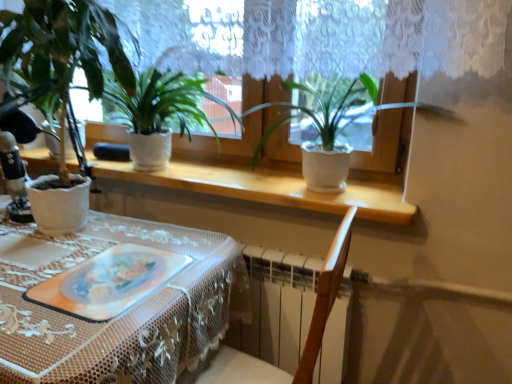
The image size is (512, 384). I want to click on white textured pot at center, so click(267, 188).

Describe the element at coordinates (164, 103) in the screenshot. I see `matte white pot at center, which is the 2th houseplant from right to left` at that location.

Identify the location of matte white pot at center, placed as the second houseplant when sorted from left to right. (164, 103).

This screenshot has width=512, height=384. What do you see at coordinates (61, 52) in the screenshot? I see `white textured pot at left, arranged as the 3th houseplant when viewed from the right` at bounding box center [61, 52].

In order to face white matte pot at center, acting as the 1th houseplant starting from the right, should I rotate leftwards or rightwards?

A 11.665 degree turn to the right will do.

The height and width of the screenshot is (384, 512). In order to click on white matte pot at center, the third houseplant positioned from the left in this screenshot , I will do `click(332, 126)`.

Where is `white textured pot at center`? white textured pot at center is located at coordinates pyautogui.click(x=267, y=188).

Which object is thinner, white lace tablecloth at lower left or white matte pot at center, acting as the 1th houseplant starting from the right?

white matte pot at center, acting as the 1th houseplant starting from the right.

How far apart are white lace tablecloth at lower left and white matte pot at center, acting as the 1th houseplant starting from the right?

white lace tablecloth at lower left and white matte pot at center, acting as the 1th houseplant starting from the right, are 26.05 inches apart.

Is white lace tablecloth at lower left positioned far away from white matte pot at center, acting as the 1th houseplant starting from the right?

They are positioned close to each other.

From a real-world perspective, starting from the white lace tablecloth at lower left, which houseplant is the 2nd one vertically above it? Please provide its 2D coordinates.

[(332, 126)]

Is translucent plastic platter at center facing towards white lace tablecloth at lower left?

Result: No, translucent plastic platter at center is not turned towards white lace tablecloth at lower left.

From the image's perspective, is translucent plastic platter at center located above white lace tablecloth at lower left?

Yes, from the image's perspective, translucent plastic platter at center is over white lace tablecloth at lower left.

Relative to white lace tablecloth at lower left, is translucent plastic platter at center in front or behind?

In the image, translucent plastic platter at center appears behind white lace tablecloth at lower left.

Does point (97, 316) appear closer or farther from the camera than point (187, 333)?

Point (97, 316).

Looking at this image, could white textured pot at center be considered to be inside white lace tablecloth at lower left?

That's incorrect, white textured pot at center is not inside white lace tablecloth at lower left.

Which object is thinner, white lace tablecloth at lower left or white textured pot at center?

Thinner between the two is white textured pot at center.

Based on the photo, from the image's perspective, which one is positioned higher, white lace tablecloth at lower left or white textured pot at center?

white textured pot at center is shown above in the image.

How many degrees apart are the facing directions of matte white pot at center, which is the 2th houseplant from right to left, and white textured pot at left, the 1th houseplant in the left-to-right sequence?

5.21 degrees separate the facing orientations of matte white pot at center, which is the 2th houseplant from right to left, and white textured pot at left, the 1th houseplant in the left-to-right sequence.

Is matte white pot at center, placed as the second houseplant when sorted from left to right, positioned with its back to white textured pot at left, the 1th houseplant in the left-to-right sequence?

No, matte white pot at center, placed as the second houseplant when sorted from left to right, is not facing away from white textured pot at left, the 1th houseplant in the left-to-right sequence.

From the image's perspective, does matte white pot at center, which is the 2th houseplant from right to left, appear lower than white textured pot at left, arranged as the 3th houseplant when viewed from the right?

Actually, matte white pot at center, which is the 2th houseplant from right to left, appears above white textured pot at left, arranged as the 3th houseplant when viewed from the right, in the image.

From a real-world perspective, which object rests below the other?

matte white pot at center, placed as the second houseplant when sorted from left to right, is physically lower.

Does white textured pot at left, the 1th houseplant in the left-to-right sequence, have a lesser height compared to white matte pot at center, acting as the 1th houseplant starting from the right?

In fact, white textured pot at left, the 1th houseplant in the left-to-right sequence, may be taller than white matte pot at center, acting as the 1th houseplant starting from the right.

From a real-world perspective, is white textured pot at left, arranged as the 3th houseplant when viewed from the right, positioned above or below white matte pot at center, the third houseplant positioned from the left?

From a real-world perspective, white textured pot at left, arranged as the 3th houseplant when viewed from the right, is physically above white matte pot at center, the third houseplant positioned from the left.

Which object is wider, white textured pot at left, arranged as the 3th houseplant when viewed from the right, or white matte pot at center, the third houseplant positioned from the left?

Wider between the two is white textured pot at left, arranged as the 3th houseplant when viewed from the right.

From the picture: Is the position of white textured pot at left, the 1th houseplant in the left-to-right sequence, more distant than that of white matte pot at center, acting as the 1th houseplant starting from the right?

No, it is in front of white matte pot at center, acting as the 1th houseplant starting from the right.

In terms of height, does translucent plastic platter at center look taller or shorter compared to white matte pot at center, acting as the 1th houseplant starting from the right?

Clearly, translucent plastic platter at center is shorter compared to white matte pot at center, acting as the 1th houseplant starting from the right.

Starting from the translucent plastic platter at center, which houseplant is the 1st one behind? Please provide its 2D coordinates.

[(332, 126)]

What's the angular difference between translucent plastic platter at center and white matte pot at center, acting as the 1th houseplant starting from the right,'s facing directions?

The angle between the facing direction of translucent plastic platter at center and the facing direction of white matte pot at center, acting as the 1th houseplant starting from the right, is 0.409 degrees.

Measure the distance between translucent plastic platter at center and white matte pot at center, the third houseplant positioned from the left.

translucent plastic platter at center is 29.05 inches away from white matte pot at center, the third houseplant positioned from the left.

Identify the location of window sill behind the translucent plastic platter at center. This screenshot has width=512, height=384. click(x=267, y=188).

Is translucent plastic platter at center aimed at white textured pot at center?

No.

Between translucent plastic platter at center and white textured pot at center, which one has smaller size?

Smaller between the two is translucent plastic platter at center.

Does translucent plastic platter at center have a greater width compared to white textured pot at center?

Yes, translucent plastic platter at center is wider than white textured pot at center.

I want to click on houseplant that is the 2nd one above the white lace tablecloth at lower left (from a real-world perspective), so click(x=332, y=126).

The width and height of the screenshot is (512, 384). In the image, there is a translucent plastic platter at center. Identify the location of table below it (from the image's perspective). (122, 314).

From the image, which object appears to be farther from translucent plastic platter at center, matte white pot at center, placed as the second houseplant when sorted from left to right, or white textured pot at left, the 1th houseplant in the left-to-right sequence?

matte white pot at center, placed as the second houseplant when sorted from left to right, lies further to translucent plastic platter at center than the other object.

Considering their positions, is white lace tablecloth at lower left positioned closer to matte white pot at center, placed as the second houseplant when sorted from left to right, than white textured pot at left, arranged as the 3th houseplant when viewed from the right?

white textured pot at left, arranged as the 3th houseplant when viewed from the right, is positioned closer to the anchor matte white pot at center, placed as the second houseplant when sorted from left to right.

Looking at the image, which one is located closer to translucent plastic platter at center, white lace tablecloth at lower left or white textured pot at left, the 1th houseplant in the left-to-right sequence?

The object closer to translucent plastic platter at center is white lace tablecloth at lower left.

Which object lies nearer to the anchor point translucent plastic platter at center, white lace tablecloth at lower left or white textured pot at center?

white lace tablecloth at lower left.

Which object lies nearer to the anchor point white textured pot at left, the 1th houseplant in the left-to-right sequence, white lace tablecloth at lower left or translucent plastic platter at center?

The object closer to white textured pot at left, the 1th houseplant in the left-to-right sequence, is white lace tablecloth at lower left.

Considering their positions, is matte white pot at center, placed as the second houseplant when sorted from left to right, positioned closer to white matte pot at center, the third houseplant positioned from the left, than white lace tablecloth at lower left?

matte white pot at center, placed as the second houseplant when sorted from left to right, is closer to white matte pot at center, the third houseplant positioned from the left.

When comparing their distances from white textured pot at center, does white matte pot at center, acting as the 1th houseplant starting from the right, or translucent plastic platter at center seem further?

translucent plastic platter at center lies further to white textured pot at center than the other object.

Based on the photo, considering their positions, is white textured pot at center positioned closer to translucent plastic platter at center than white lace tablecloth at lower left?

Based on the image, white lace tablecloth at lower left appears to be nearer to translucent plastic platter at center.

Image resolution: width=512 pixels, height=384 pixels. I want to click on houseplant situated between white textured pot at left, arranged as the 3th houseplant when viewed from the right, and white matte pot at center, acting as the 1th houseplant starting from the right, from left to right, so click(164, 103).

Where is `platter between white lace tablecloth at lower left and white matte pot at center, the third houseplant positioned from the left, from left to right`? The width and height of the screenshot is (512, 384). platter between white lace tablecloth at lower left and white matte pot at center, the third houseplant positioned from the left, from left to right is located at coordinates (108, 281).

Find the location of a particular element. The height and width of the screenshot is (384, 512). window sill between matte white pot at center, placed as the second houseplant when sorted from left to right, and translucent plastic platter at center from top to bottom is located at coordinates (267, 188).

Find the location of a particular element. This screenshot has width=512, height=384. platter between white textured pot at left, the 1th houseplant in the left-to-right sequence, and white lace tablecloth at lower left in the up-down direction is located at coordinates (108, 281).